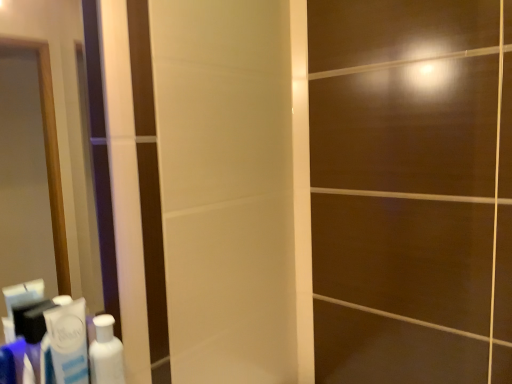
Identify the location of white glossy bottle at lower left. This screenshot has width=512, height=384. (106, 353).

Describe the element at coordinates (106, 353) in the screenshot. I see `white glossy bottle at lower left` at that location.

Where is `white glossy toothpaste at lower left`? The image size is (512, 384). white glossy toothpaste at lower left is located at coordinates (68, 340).

Measure the distance between point (77, 331) and camera.

A distance of 24.17 inches exists between point (77, 331) and camera.

What is the approximate width of white glossy toothpaste at lower left?

white glossy toothpaste at lower left is 1.47 inches in width.

What do you see at coordinates (68, 340) in the screenshot? I see `white glossy toothpaste at lower left` at bounding box center [68, 340].

Identify the location of white glossy bottle at lower left. The height and width of the screenshot is (384, 512). (106, 353).

Does white glossy toothpaste at lower left appear on the right side of white glossy bottle at lower left?

Incorrect, white glossy toothpaste at lower left is not on the right side of white glossy bottle at lower left.

Is white glossy toothpaste at lower left further to camera compared to white glossy bottle at lower left?

No, it is in front of white glossy bottle at lower left.

Between point (82, 337) and point (97, 324), which one is positioned in front?

The point (82, 337) is closer.

From the image's perspective, which object appears higher, white glossy toothpaste at lower left or white glossy bottle at lower left?

white glossy toothpaste at lower left appears higher in the image.

From a real-world perspective, which object rests below the other?

white glossy bottle at lower left is physically lower.

Considering the relative sizes of white glossy toothpaste at lower left and white glossy bottle at lower left in the image provided, is white glossy toothpaste at lower left wider than white glossy bottle at lower left?

Incorrect, the width of white glossy toothpaste at lower left does not surpass that of white glossy bottle at lower left.

Considering the relative sizes of white glossy toothpaste at lower left and white glossy bottle at lower left in the image provided, is white glossy toothpaste at lower left taller than white glossy bottle at lower left?

Yes.

Which of these two, white glossy toothpaste at lower left or white glossy bottle at lower left, is smaller?

Smaller between the two is white glossy bottle at lower left.

Could white glossy bottle at lower left be considered to be inside white glossy toothpaste at lower left?

No, white glossy bottle at lower left is not a part of white glossy toothpaste at lower left.

Would you consider white glossy toothpaste at lower left to be distant from white glossy bottle at lower left?

No, white glossy toothpaste at lower left is not far from white glossy bottle at lower left.

Is white glossy toothpaste at lower left facing towards white glossy bottle at lower left?

No, white glossy toothpaste at lower left is not turned towards white glossy bottle at lower left.

The height and width of the screenshot is (384, 512). In order to click on bottle on the right of white glossy toothpaste at lower left in this screenshot , I will do `click(106, 353)`.

Would you say white glossy bottle at lower left is to the left or to the right of white glossy toothpaste at lower left in the picture?

From the image, it's evident that white glossy bottle at lower left is to the right of white glossy toothpaste at lower left.

Which object is closer to the camera taking this photo, white glossy bottle at lower left or white glossy toothpaste at lower left?

white glossy toothpaste at lower left is more forward.

Does point (94, 378) appear closer or farther from the camera than point (63, 353)?

Point (94, 378) appears to be farther away from the viewer than point (63, 353).

From the image's perspective, is white glossy bottle at lower left located above or below white glossy toothpaste at lower left?

From the image's perspective, white glossy bottle at lower left appears below white glossy toothpaste at lower left.

Consider the image. From a real-world perspective, is white glossy bottle at lower left physically below white glossy toothpaste at lower left?

Yes, from a real-world perspective, white glossy bottle at lower left is under white glossy toothpaste at lower left.

In terms of width, does white glossy bottle at lower left look wider or thinner when compared to white glossy toothpaste at lower left?

Considering their sizes, white glossy bottle at lower left looks broader than white glossy toothpaste at lower left.

Does white glossy bottle at lower left have a greater height compared to white glossy toothpaste at lower left?

Incorrect, the height of white glossy bottle at lower left is not larger of that of white glossy toothpaste at lower left.

Considering the sizes of objects white glossy bottle at lower left and white glossy toothpaste at lower left in the image provided, who is bigger, white glossy bottle at lower left or white glossy toothpaste at lower left?

white glossy toothpaste at lower left is bigger.

Is white glossy bottle at lower left outside of white glossy toothpaste at lower left?

Yes, white glossy bottle at lower left is not within white glossy toothpaste at lower left.

Are white glossy bottle at lower left and white glossy toothpaste at lower left beside each other?

Yes, white glossy bottle at lower left and white glossy toothpaste at lower left clearly make contact.

Looking at this image, is white glossy bottle at lower left oriented away from white glossy toothpaste at lower left?

No, white glossy bottle at lower left is not facing the opposite direction of white glossy toothpaste at lower left.

Measure the distance from white glossy bottle at lower left to white glossy toothpaste at lower left.

white glossy bottle at lower left and white glossy toothpaste at lower left are 1.75 inches apart.

Locate an element on the screen. The image size is (512, 384). toothpaste in front of the white glossy bottle at lower left is located at coordinates (x=68, y=340).

You are a GUI agent. You are given a task and a screenshot of the screen. Output one action in this format:
    pyautogui.click(x=<x>, y=<y>)
    Task: Click on the bottle behind the white glossy toothpaste at lower left
    This screenshot has width=512, height=384.
    Given the screenshot: What is the action you would take?
    pyautogui.click(x=106, y=353)

Where is `toothpaste above the white glossy bottle at lower left (from a real-world perspective)`? toothpaste above the white glossy bottle at lower left (from a real-world perspective) is located at coordinates (68, 340).